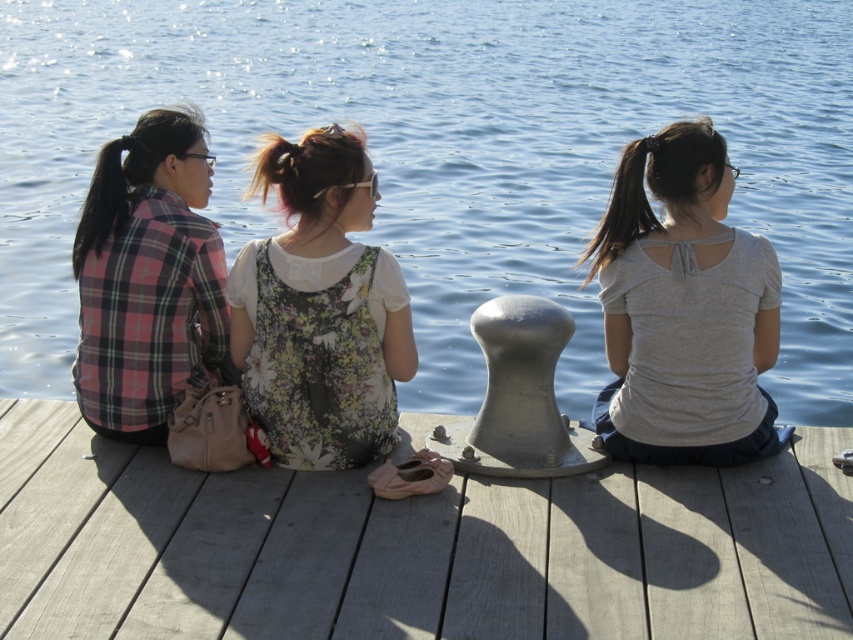
Is blue water at center smaller than smooth wooden dock at center?

Actually, blue water at center might be larger than smooth wooden dock at center.

Which is below, blue water at center or smooth wooden dock at center?

smooth wooden dock at center is lower down.

Which is behind, point (616, 90) or point (695, 518)?

The point (616, 90) is more distant.

Where is `blue water at center`? Image resolution: width=853 pixels, height=640 pixels. blue water at center is located at coordinates (445, 154).

Which of these two, gray matte shirt at center or plaid fabric shirt at left, stands taller?

Standing taller between the two is plaid fabric shirt at left.

Based on the photo, can you confirm if gray matte shirt at center is positioned below plaid fabric shirt at left?

Yes, gray matte shirt at center is below plaid fabric shirt at left.

Is point (622, 352) less distant than point (96, 337)?

No, it is not.

At what (x,y) coordinates should I click in order to perform the action: click on gray matte shirt at center. Please return your answer as a coordinate pair (x, y). The image size is (853, 640). Looking at the image, I should click on (683, 308).

Is gray matte shirt at center positioned behind floral fabric dress at center?

Yes, gray matte shirt at center is behind floral fabric dress at center.

Is gray matte shirt at center shorter than floral fabric dress at center?

No.

At what (x,y) coordinates should I click in order to perform the action: click on gray matte shirt at center. Please return your answer as a coordinate pair (x, y). The width and height of the screenshot is (853, 640). Looking at the image, I should click on (683, 308).

The image size is (853, 640). In order to click on gray matte shirt at center in this screenshot , I will do `click(683, 308)`.